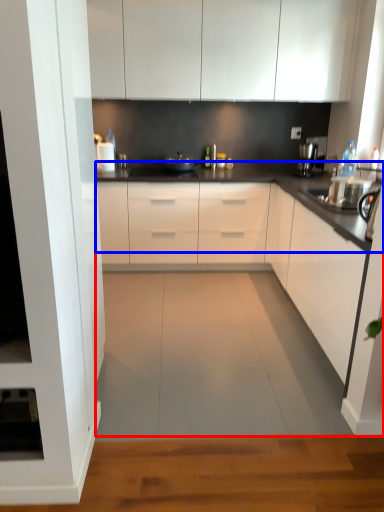
Question: Which of the following is the farthest to the observer, countertop (highlighted by a red box) or countertop (highlighted by a blue box)?

Choices:
 (A) countertop
 (B) countertop

Answer: (B)